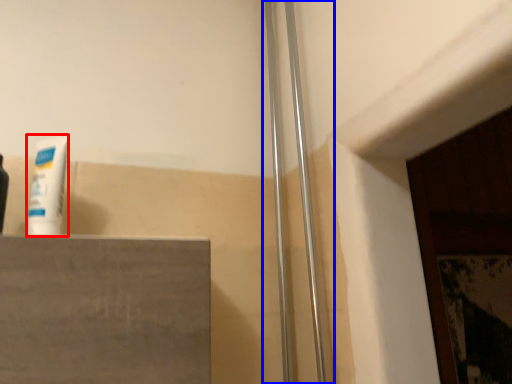
Question: Which point is further to the camera, toothpaste (highlighted by a red box) or shower door (highlighted by a blue box)?

Choices:
 (A) toothpaste
 (B) shower door

Answer: (B)